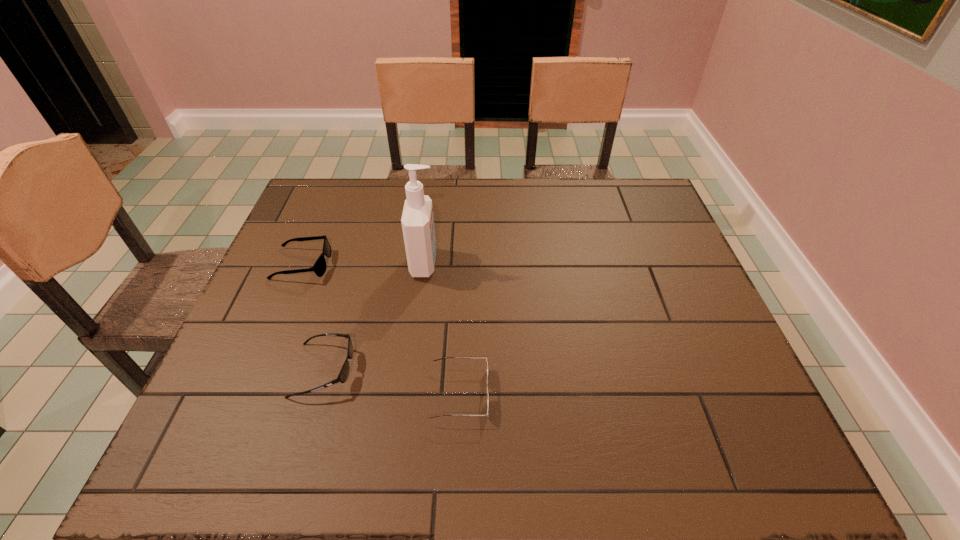
Where is `free spot between the shortest object and the second object from left to right`? The image size is (960, 540). free spot between the shortest object and the second object from left to right is located at coordinates (392, 382).

Where is `free space between the farthest sunglasses and the shortest sunglasses`? Image resolution: width=960 pixels, height=540 pixels. free space between the farthest sunglasses and the shortest sunglasses is located at coordinates (381, 329).

Where is `free space between the third object from left to right and the second sunglasses from right to left`? free space between the third object from left to right and the second sunglasses from right to left is located at coordinates coord(374,316).

What are the coordinates of `free area in between the farthest sunglasses and the tallest object` in the screenshot? It's located at (364, 264).

Where is `empty space that is in between the leftmost object and the second object from left to right`? This screenshot has height=540, width=960. empty space that is in between the leftmost object and the second object from left to right is located at coordinates (313, 317).

The width and height of the screenshot is (960, 540). I want to click on free area in between the second sunglasses from right to left and the cleansing agent, so [x=374, y=316].

At what (x,y) coordinates should I click in order to perform the action: click on vacant region between the tallest object and the second sunglasses from left to right. Please return your answer as a coordinate pair (x, y). Image resolution: width=960 pixels, height=540 pixels. Looking at the image, I should click on (374, 316).

Image resolution: width=960 pixels, height=540 pixels. I want to click on vacant space that's between the rightmost sunglasses and the farthest sunglasses, so click(x=381, y=329).

Select which object appears as the third closest to the farthest sunglasses. Please provide its 2D coordinates. Your answer should be formatted as a tuple, i.e. [(x, y)], where the tuple contains the x and y coordinates of a point satisfying the conditions above.

[(443, 358)]

Find the location of a particular element. object that is the third closest to the second sunglasses from left to right is located at coordinates (417, 220).